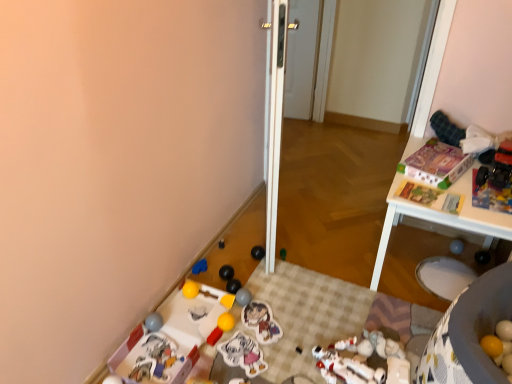
Question: Considering the relative sizes of white glossy screen door at center, the first screen door positioned from the back, and plastic toy at lower left, the 3th toy from the left, in the image provided, is white glossy screen door at center, the first screen door positioned from the back, thinner than plastic toy at lower left, the 3th toy from the left,?

Choices:
 (A) yes
 (B) no

Answer: (A)

Question: Is white glossy screen door at center, arranged as the first screen door when viewed from the right, aimed at plastic toy at lower left, the 3th toy from the left?

Choices:
 (A) yes
 (B) no

Answer: (A)

Question: Does white glossy screen door at center, arranged as the first screen door when viewed from the right, have a larger size compared to plastic toy at lower left, the 3th toy from the left?

Choices:
 (A) yes
 (B) no

Answer: (A)

Question: Is white glossy screen door at center, which appears as the second screen door when viewed from the front, at the left side of plastic toy at lower left, which is the 17th toy in right-to-left order?

Choices:
 (A) yes
 (B) no

Answer: (B)

Question: Is white glossy screen door at center, the first screen door positioned from the back, positioned behind plastic toy at lower left, the 3th toy from the left?

Choices:
 (A) no
 (B) yes

Answer: (B)

Question: Does white glossy screen door at center, arranged as the first screen door when viewed from the right, have a greater width compared to plastic toy at lower left, which is the 17th toy in right-to-left order?

Choices:
 (A) no
 (B) yes

Answer: (A)

Question: Is white glossy door at center, which is counted as the 2th screen door, starting from the back, not close to matte gray ball at lower left, placed as the 1th toy when sorted from left to right?

Choices:
 (A) no
 (B) yes

Answer: (A)

Question: Considering the relative sizes of white glossy door at center, the first screen door from the left, and matte gray ball at lower left, placed as the 1th toy when sorted from left to right, in the image provided, is white glossy door at center, the first screen door from the left, bigger than matte gray ball at lower left, placed as the 1th toy when sorted from left to right,?

Choices:
 (A) no
 (B) yes

Answer: (B)

Question: Is the depth of white glossy door at center, the first screen door from the left, greater than that of matte gray ball at lower left, acting as the nineteenth toy starting from the right?

Choices:
 (A) no
 (B) yes

Answer: (A)

Question: Does white glossy door at center, the first screen door from the left, have a lesser height compared to matte gray ball at lower left, placed as the 1th toy when sorted from left to right?

Choices:
 (A) yes
 (B) no

Answer: (B)

Question: Does white glossy door at center, which is counted as the 2th screen door, starting from the back, have a greater height compared to matte gray ball at lower left, placed as the 1th toy when sorted from left to right?

Choices:
 (A) yes
 (B) no

Answer: (A)

Question: From the image's perspective, is white glossy door at center, the first screen door from the left, above matte gray ball at lower left, acting as the nineteenth toy starting from the right?

Choices:
 (A) yes
 (B) no

Answer: (A)

Question: Considering the relative positions of black rubber ball at lower center, the eighth toy in the right-to-left sequence, and yellow matte toy at lower center, acting as the 12th toy starting from the right, in the image provided, is black rubber ball at lower center, the eighth toy in the right-to-left sequence, behind yellow matte toy at lower center, acting as the 12th toy starting from the right,?

Choices:
 (A) yes
 (B) no

Answer: (A)